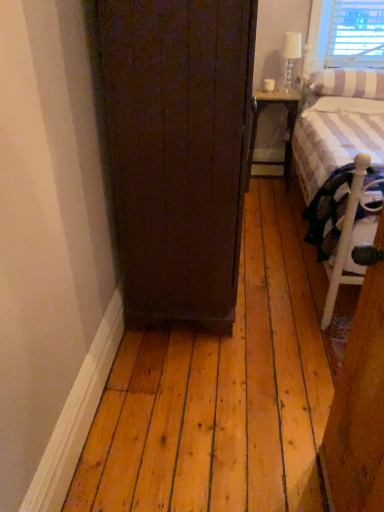
Locate an element on the screen. vacant area to the right of dark wood door at center is located at coordinates (282, 273).